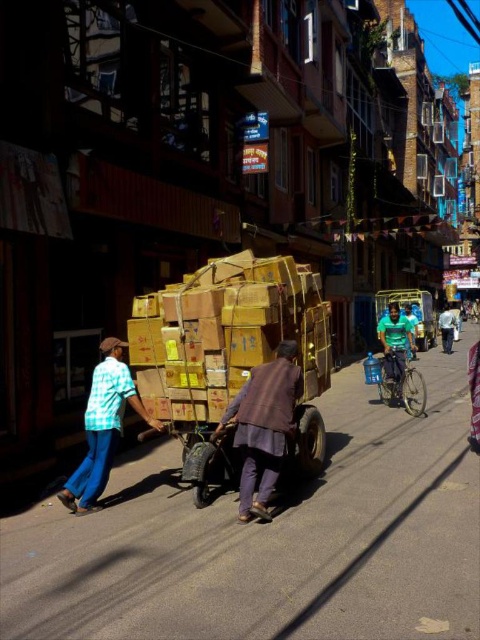
Can you confirm if checkered fabric shirt at left is positioned to the right of green fabric shirt at right?

No, checkered fabric shirt at left is not to the right of green fabric shirt at right.

Can you confirm if checkered fabric shirt at left is smaller than green fabric shirt at right?

Indeed, checkered fabric shirt at left has a smaller size compared to green fabric shirt at right.

Who is more distant from viewer, [71,499] or [446,312]?

Positioned behind is point [446,312].

Locate an element on the screen. This screenshot has height=640, width=480. checkered fabric shirt at left is located at coordinates (103, 426).

Between point (271, 410) and point (395, 360), which one is positioned in front?

Positioned in front is point (271, 410).

Is brown woolen coat at center below green matte shirt at center?

Yes.

Is point (252, 484) positioned in front of point (394, 326)?

Yes.

The height and width of the screenshot is (640, 480). I want to click on brown woolen coat at center, so click(264, 426).

Is point (117, 385) farther from viewer compared to point (402, 337)?

No, it is not.

Which is in front, point (98, 484) or point (391, 340)?

Point (98, 484) is more forward.

This screenshot has width=480, height=640. Find the location of `checkered fabric shirt at left`. checkered fabric shirt at left is located at coordinates (103, 426).